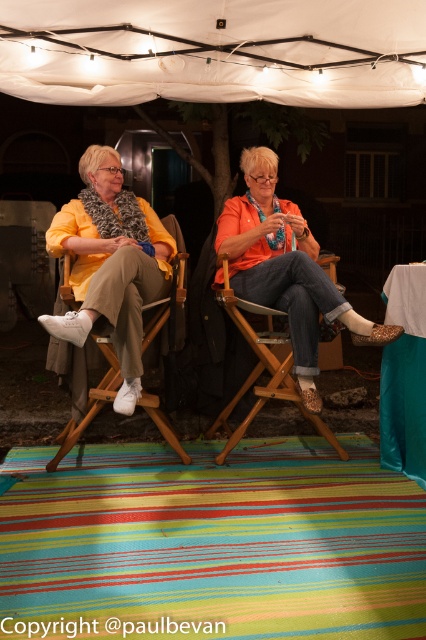
Question: Which of the following is the closest to the observer?

Choices:
 (A) (236, 211)
 (B) (288, 353)
 (C) (123, 332)
 (D) (60, 42)

Answer: (C)

Question: Does orange fabric at center come behind wooden chair at center?

Choices:
 (A) yes
 (B) no

Answer: (B)

Question: Is matte yellow sweater at center thinner than wooden chair at center?

Choices:
 (A) yes
 (B) no

Answer: (B)

Question: Can you confirm if white fabric canopy at upper center is thinner than wooden chair at center?

Choices:
 (A) yes
 (B) no

Answer: (B)

Question: Which is farther from the orange fabric at center?

Choices:
 (A) matte yellow jacket at center
 (B) white fabric canopy at upper center
 (C) wooden chair at center
 (D) matte yellow sweater at center

Answer: (B)

Question: Which object is closer to the camera taking this photo?

Choices:
 (A) wooden chair at center
 (B) matte yellow sweater at center
 (C) matte yellow jacket at center
 (D) white fabric canopy at upper center

Answer: (C)